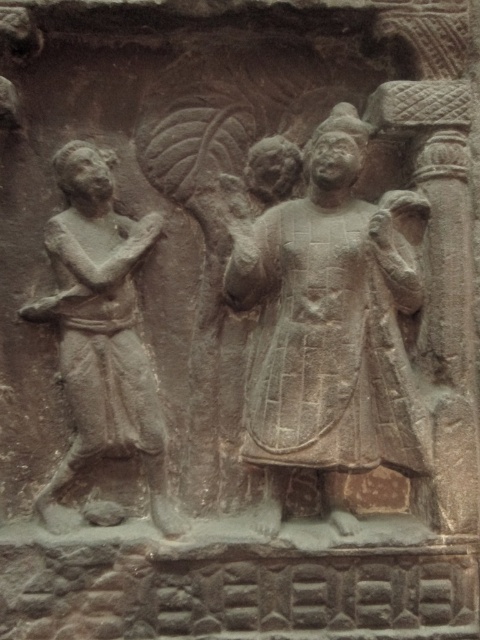
Can you confirm if carved stone figure at center is shorter than gray stone figure at left?

No, carved stone figure at center is not shorter than gray stone figure at left.

Can you confirm if carved stone figure at center is positioned to the left of gray stone figure at left?

Incorrect, carved stone figure at center is not on the left side of gray stone figure at left.

What do you see at coordinates (327, 324) in the screenshot? Image resolution: width=480 pixels, height=640 pixels. I see `carved stone figure at center` at bounding box center [327, 324].

Where is `carved stone figure at center`? The image size is (480, 640). carved stone figure at center is located at coordinates (327, 324).